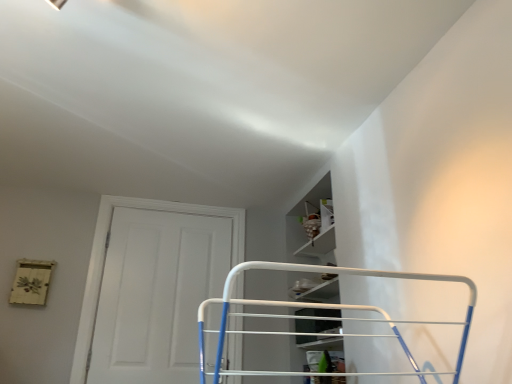
Image resolution: width=512 pixels, height=384 pixels. I want to click on white matte door at left, so click(x=157, y=287).

Describe the element at coordinates (157, 287) in the screenshot. The image size is (512, 384). I see `white matte door at left` at that location.

Measure the distance between point (172, 374) and camera.

Point (172, 374) and camera are 8.50 feet apart from each other.

Where is `white matte door at left`? Image resolution: width=512 pixels, height=384 pixels. white matte door at left is located at coordinates (157, 287).